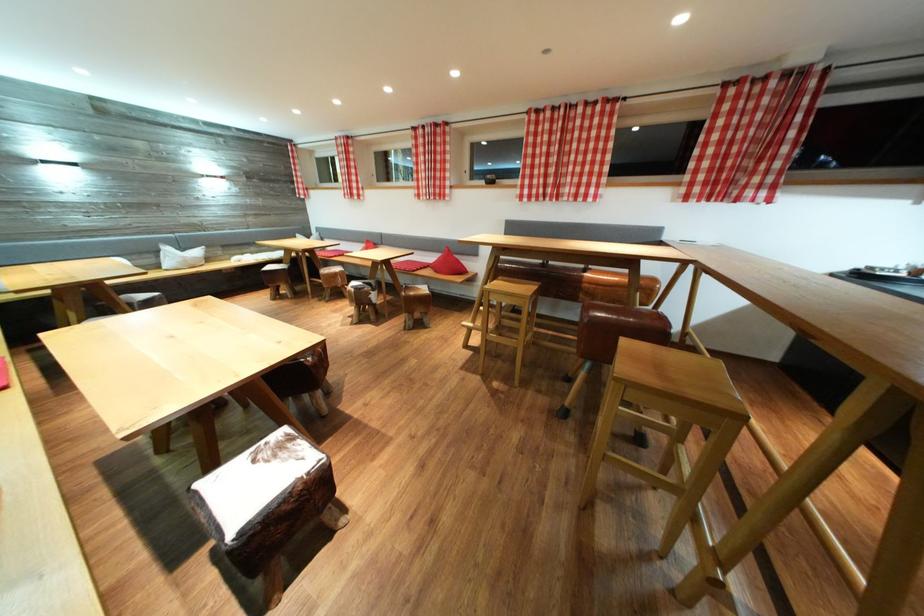
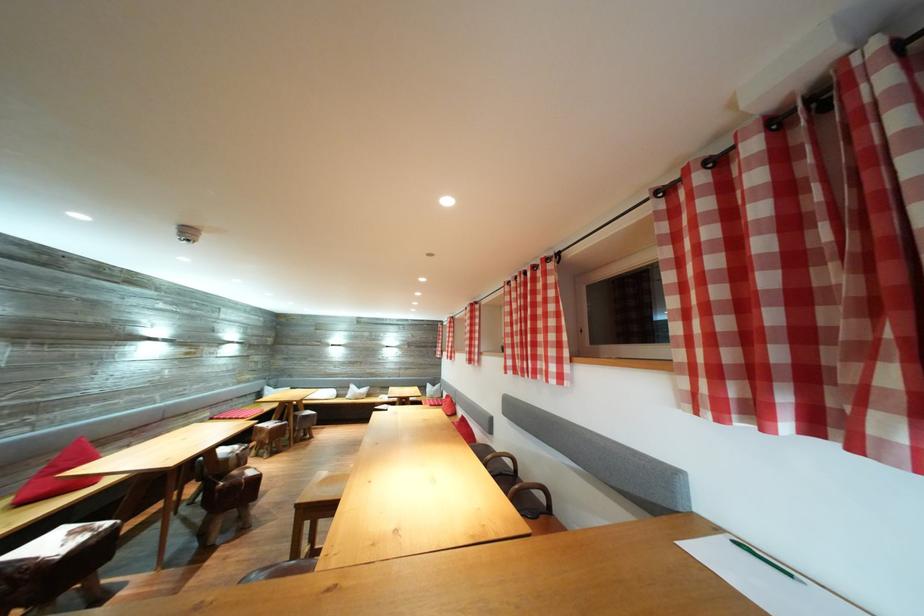
The point at (214, 265) is marked in the first image. Where is the corresponding point in the second image?

(375, 400)